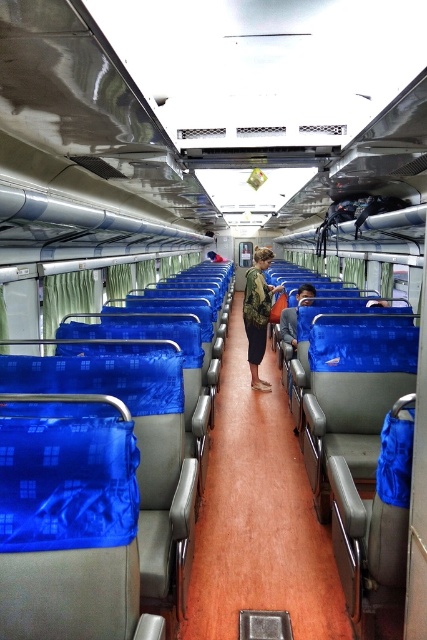
Is brown wood floor at center taller than camouflage-patterned jacket at center?

No.

Does brown wood floor at center lie behind camouflage-patterned jacket at center?

No.

Image resolution: width=427 pixels, height=640 pixels. Describe the element at coordinates (259, 515) in the screenshot. I see `brown wood floor at center` at that location.

At what (x,y) coordinates should I click in order to perform the action: click on brown wood floor at center. Please return your answer as a coordinate pair (x, y). This screenshot has height=640, width=427. Looking at the image, I should click on (259, 515).

Who is positioned more to the right, brown wood floor at center or blue fabric bag at center?

blue fabric bag at center is more to the right.

Who is more forward, (251, 472) or (310, 289)?

Point (251, 472) is in front.

What do you see at coordinates (259, 515) in the screenshot? This screenshot has width=427, height=640. I see `brown wood floor at center` at bounding box center [259, 515].

Where is `brown wood floor at center`? brown wood floor at center is located at coordinates (259, 515).

Does camouflage-patterned jacket at center have a lesser width compared to blue fabric bag at center?

No, camouflage-patterned jacket at center is not thinner than blue fabric bag at center.

Is point (263, 268) positioned after point (286, 323)?

No.

The height and width of the screenshot is (640, 427). I want to click on camouflage-patterned jacket at center, so click(257, 312).